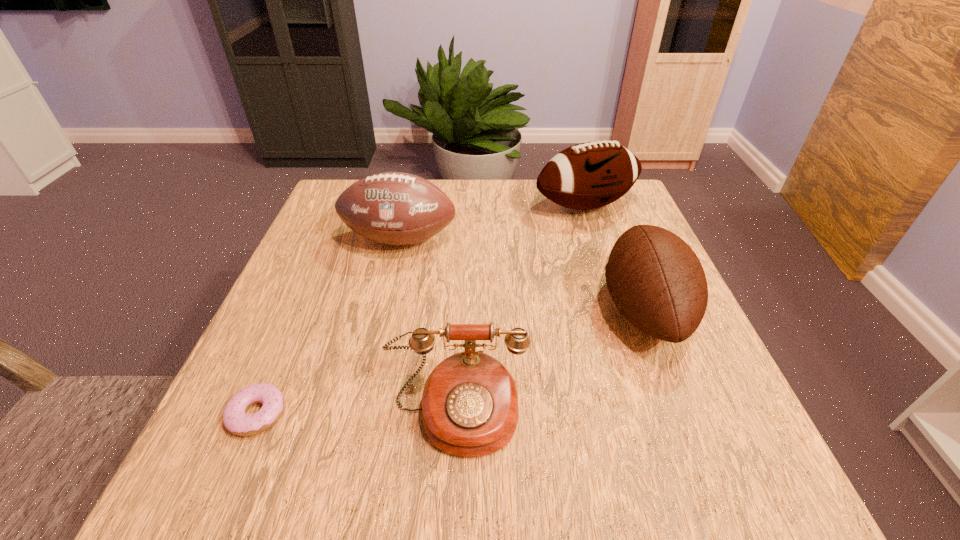
Identify the location of vacant space that satisfies the following two spatial constraints: 1. on the laces of the nearest football; 2. on the dial of the fourth tallest object. This screenshot has width=960, height=540. (684, 411).